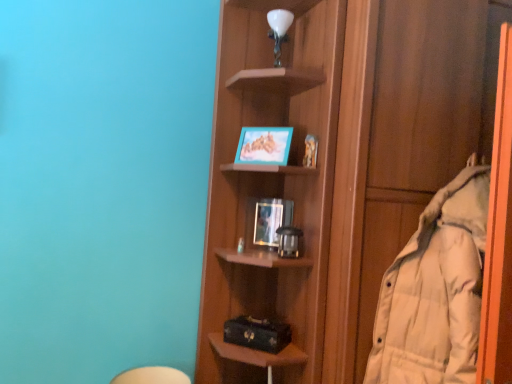
Question: In terms of height, does teal matte picture frame at upper center, positioned as the 2th picture frame in bottom-to-top order, look taller or shorter compared to wooden shelf at center?

Choices:
 (A) short
 (B) tall

Answer: (A)

Question: Is teal matte picture frame at upper center, which ranks as the first picture frame in top-to-bottom order, spatially inside wooden shelf at center, or outside of it?

Choices:
 (A) inside
 (B) outside

Answer: (B)

Question: Estimate the real-world distances between objects in this image. Which object is farther from the white down-filled coat at right?

Choices:
 (A) teal matte picture frame at upper center, which ranks as the first picture frame in top-to-bottom order
 (B) matte plastic picture frame at middle, the 2th picture frame from the top
 (C) wooden shelf at center

Answer: (A)

Question: Which of these objects is positioned farthest from the wooden shelf at center?

Choices:
 (A) matte plastic picture frame at middle, marked as the first picture frame in a bottom-to-top arrangement
 (B) white down-filled coat at right
 (C) teal matte picture frame at upper center, which ranks as the first picture frame in top-to-bottom order

Answer: (A)